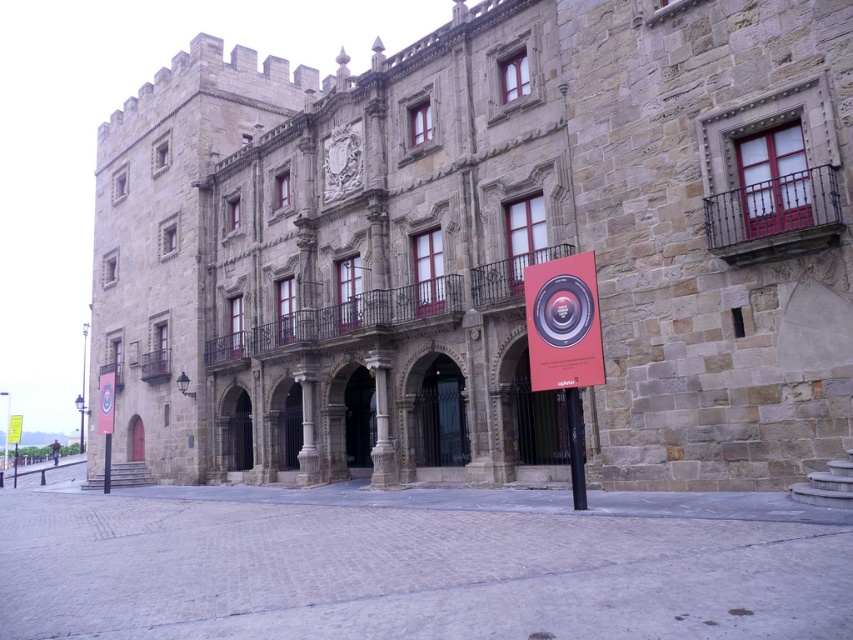
Is matte red poster at center above yellow paper sign at center?

Yes, matte red poster at center is above yellow paper sign at center.

Which of these two, matte red poster at center or yellow paper sign at center, stands taller?

With more height is matte red poster at center.

Locate an element on the screen. The image size is (853, 640). matte red poster at center is located at coordinates (563, 323).

What do you see at coordinates (563, 323) in the screenshot? Image resolution: width=853 pixels, height=640 pixels. I see `matte red poster at center` at bounding box center [563, 323].

Does matte red poster at center have a lesser width compared to black metal pole at center?

In fact, matte red poster at center might be wider than black metal pole at center.

Between point (560, 371) and point (579, 476), which one is positioned behind?

Point (560, 371)

The height and width of the screenshot is (640, 853). Identify the location of matte red poster at center. (563, 323).

Does black metal pole at center appear on the right side of yellow paper sign at center?

Correct, you'll find black metal pole at center to the right of yellow paper sign at center.

Which of these two, black metal pole at center or yellow paper sign at center, stands taller?

Standing taller between the two is yellow paper sign at center.

Describe the element at coordinates (575, 448) in the screenshot. I see `black metal pole at center` at that location.

You are a GUI agent. You are given a task and a screenshot of the screen. Output one action in this format:
    pyautogui.click(x=<x>, y=<y>)
    Task: Click on the black metal pole at center
    
    Given the screenshot: What is the action you would take?
    pos(575,448)